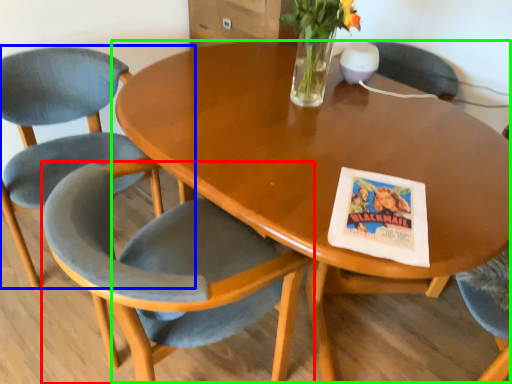
Question: Which object is positioned farthest from chair (highlighted by a red box)? Select from chair (highlighted by a blue box) and coffee table (highlighted by a green box).

Choices:
 (A) chair
 (B) coffee table

Answer: (A)